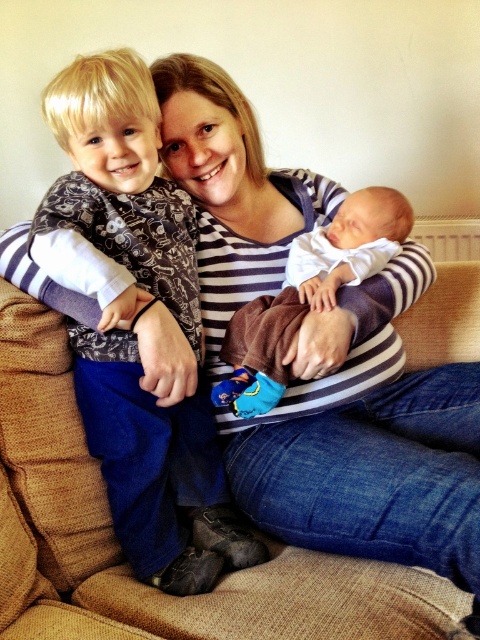
What is the location of the striped fabric at center in the image?

The striped fabric at center is located at point [368,440].

You are a photographer setting up for a family portrait. You need to ensure that the matte black shirt at left and the brown soft blanket at center are both visible in the frame. Based on their positions, which object should you adjust to keep both in the shot?

The matte black shirt at left is to the left of the brown soft blanket at center. To keep both in the frame, adjust the camera angle slightly to the left so that the matte black shirt at left remains visible while ensuring the brown soft blanket at center stays within the shot.